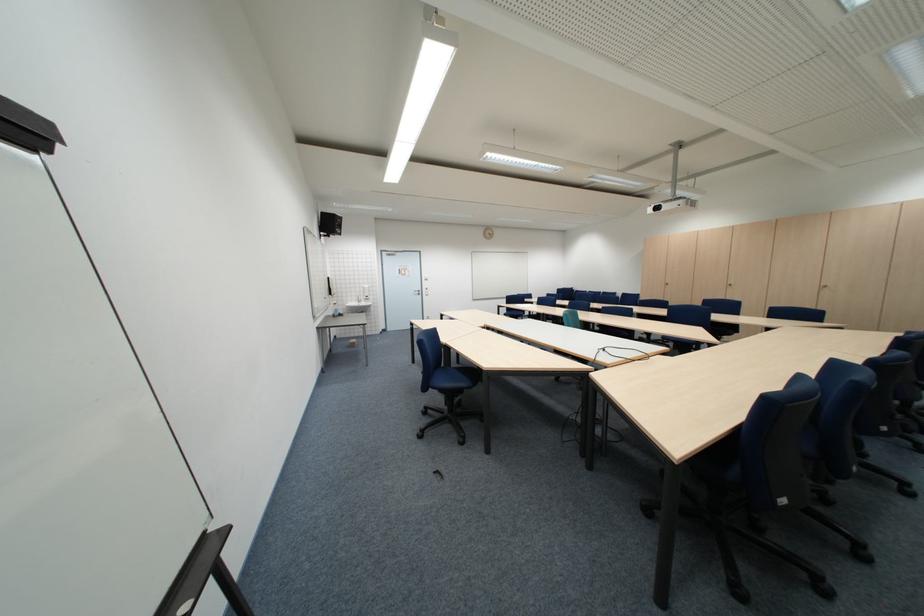
Where would you push the soap dispenser pump? Please return your answer as a coordinate pair (x, y).

(335, 302)